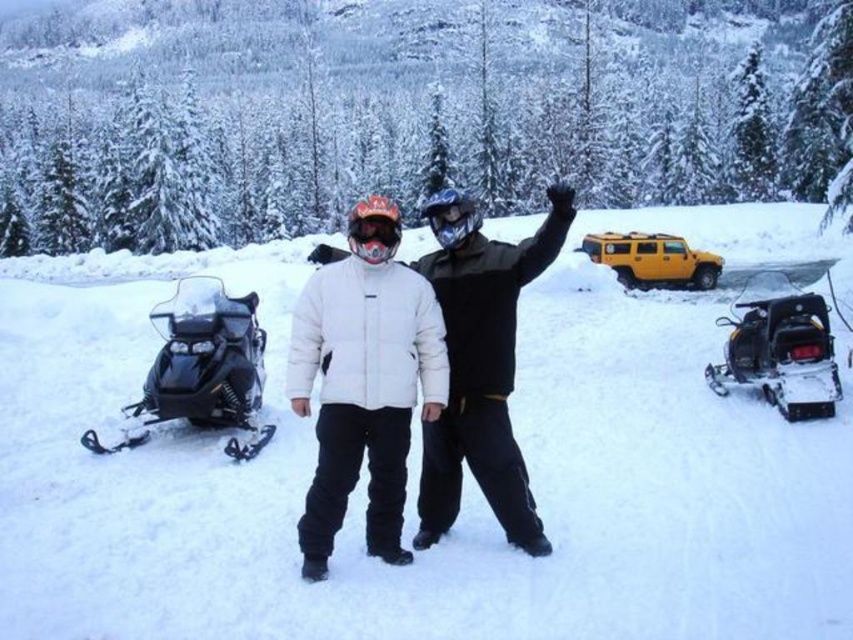
Can you confirm if white matte jacket at center is smaller than matte orange goggles at center?

Actually, white matte jacket at center might be larger than matte orange goggles at center.

At what (x,y) coordinates should I click in order to perform the action: click on white matte jacket at center. Please return your answer as a coordinate pair (x, y). Looking at the image, I should click on (480, 364).

Who is more distant from viewer, (466,348) or (352,232)?

Positioned behind is point (466,348).

The height and width of the screenshot is (640, 853). In order to click on white matte jacket at center in this screenshot , I will do `click(480, 364)`.

Between white fluffy snow at center and black plastic snowmobile at left, which one appears on the left side from the viewer's perspective?

white fluffy snow at center

Is point (519, 620) positioned before point (236, 326)?

Yes, it is in front of point (236, 326).

What are the coordinates of `white fluffy snow at center` in the screenshot? It's located at (465, 472).

Between black plastic snowmobile at left and black plastic snowmobile at lower right, which one has less height?

With less height is black plastic snowmobile at lower right.

Find the location of a particular element. black plastic snowmobile at left is located at coordinates point(201,369).